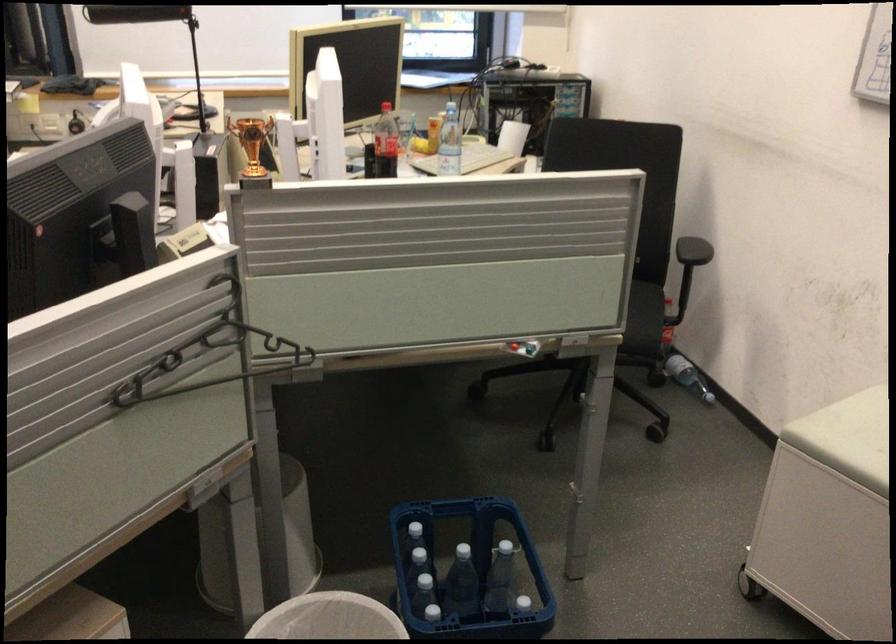
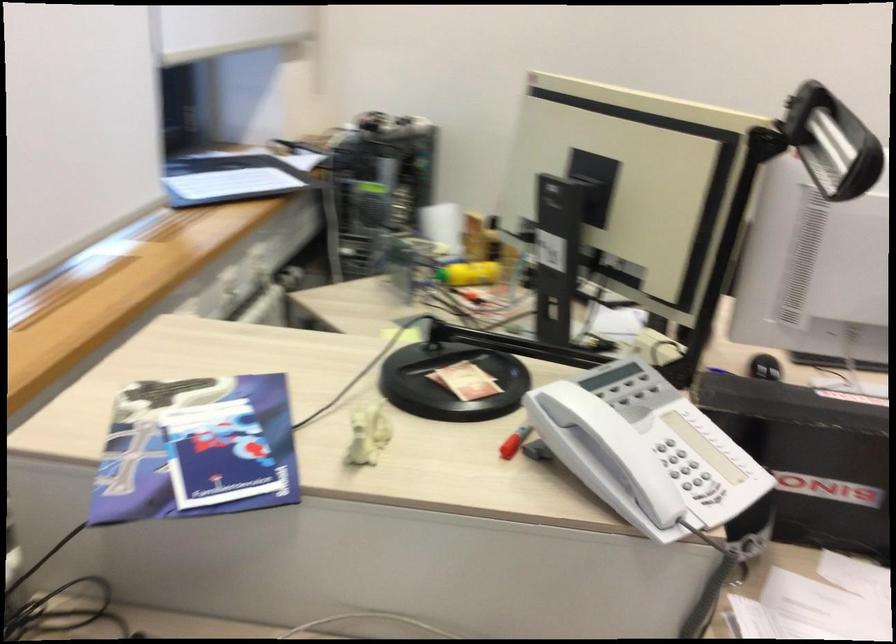
Question: I am providing you with two images of the same scene from different viewpoints. Which of the following objects are not visible in image2?

Choices:
 (A) white phone handset
 (B) diffuser bottle
 (C) purple brochure
 (D) plastic water bottle

Answer: (D)